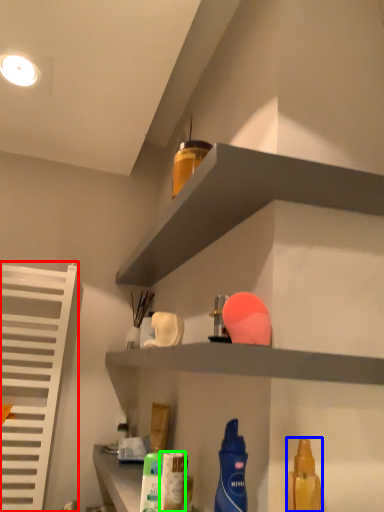
Question: Considering the real-world distances, which object is closest to shutter (highlighted by a red box)? cleaning product (highlighted by a blue box) or cleaning product (highlighted by a green box).

Choices:
 (A) cleaning product
 (B) cleaning product

Answer: (B)